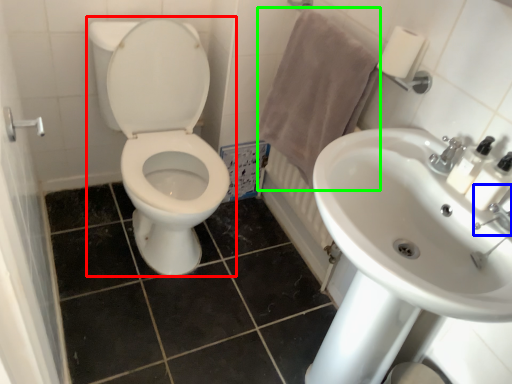
Question: Which is farther away from toilet (highlighted by a red box)? plumbing fixture (highlighted by a blue box) or bath towel (highlighted by a green box)?

Choices:
 (A) plumbing fixture
 (B) bath towel

Answer: (A)